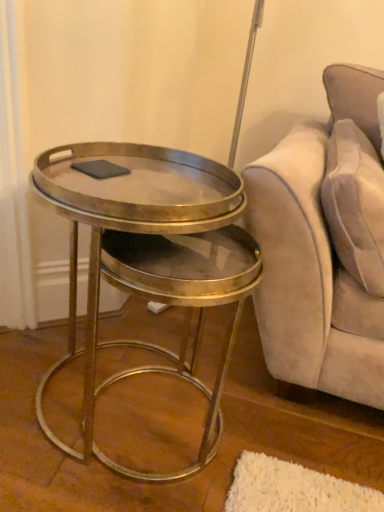
Question: Is suede-like beige pillow at upper right positioned before gray matte pad at center?

Choices:
 (A) no
 (B) yes

Answer: (B)

Question: From a real-world perspective, is suede-like beige pillow at upper right below gray matte pad at center?

Choices:
 (A) yes
 (B) no

Answer: (A)

Question: Would you say suede-like beige pillow at upper right is a long distance from gray matte pad at center?

Choices:
 (A) yes
 (B) no

Answer: (B)

Question: Is suede-like beige pillow at upper right looking in the opposite direction of gray matte pad at center?

Choices:
 (A) no
 (B) yes

Answer: (B)

Question: Does suede-like beige pillow at upper right appear on the left side of gray matte pad at center?

Choices:
 (A) yes
 (B) no

Answer: (B)

Question: Can you confirm if suede-like beige pillow at upper right is wider than gray matte pad at center?

Choices:
 (A) no
 (B) yes

Answer: (B)

Question: Is metallic/goldenobject at left further to the viewer compared to suede-like beige pillow at upper right?

Choices:
 (A) no
 (B) yes

Answer: (A)

Question: From the image's perspective, is metallic/goldenobject at left on top of suede-like beige pillow at upper right?

Choices:
 (A) no
 (B) yes

Answer: (A)

Question: Is metallic/goldenobject at left next to suede-like beige pillow at upper right and touching it?

Choices:
 (A) yes
 (B) no

Answer: (B)

Question: Can you confirm if metallic/goldenobject at left is bigger than suede-like beige pillow at upper right?

Choices:
 (A) yes
 (B) no

Answer: (A)

Question: From a real-world perspective, is metallic/goldenobject at left on top of suede-like beige pillow at upper right?

Choices:
 (A) no
 (B) yes

Answer: (A)

Question: Is metallic/goldenobject at left looking in the opposite direction of suede-like beige pillow at upper right?

Choices:
 (A) no
 (B) yes

Answer: (A)

Question: Is there a large distance between metallic/goldenobject at left and gray matte pad at center?

Choices:
 (A) no
 (B) yes

Answer: (A)